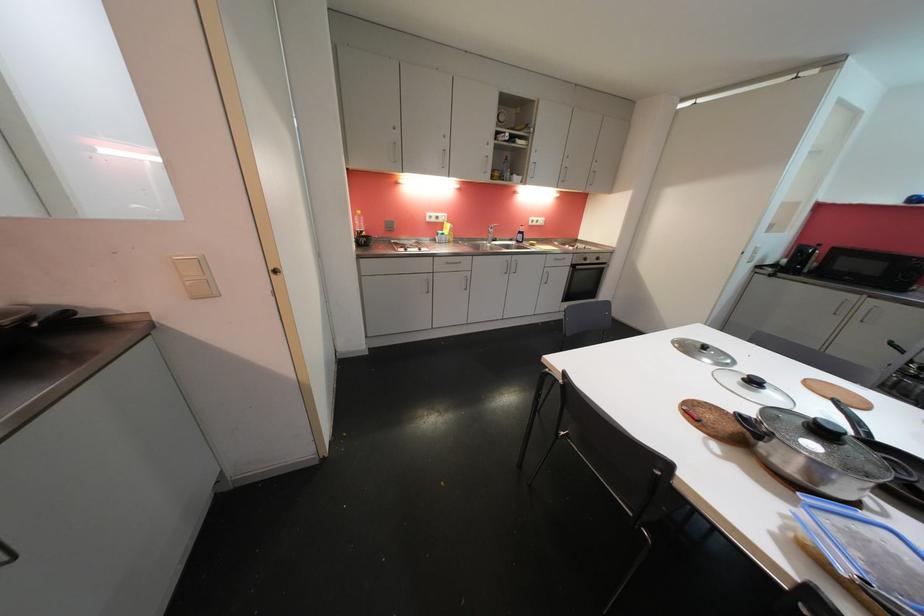
I want to click on faucet handle, so click(493, 223).